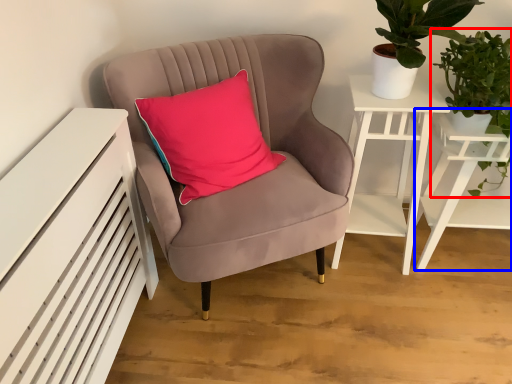
Question: Which of the following is the closest to the observer, houseplant (highlighted by a red box) or table (highlighted by a blue box)?

Choices:
 (A) houseplant
 (B) table

Answer: (A)